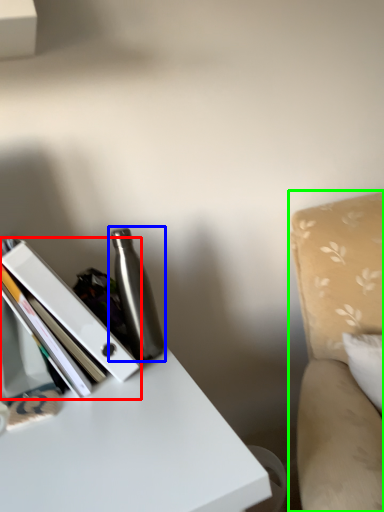
Question: Estimate the real-world distances between objects in this image. Which object is closer to book (highlighted by a red box), bottle (highlighted by a blue box) or swivel chair (highlighted by a green box)?

Choices:
 (A) bottle
 (B) swivel chair

Answer: (A)